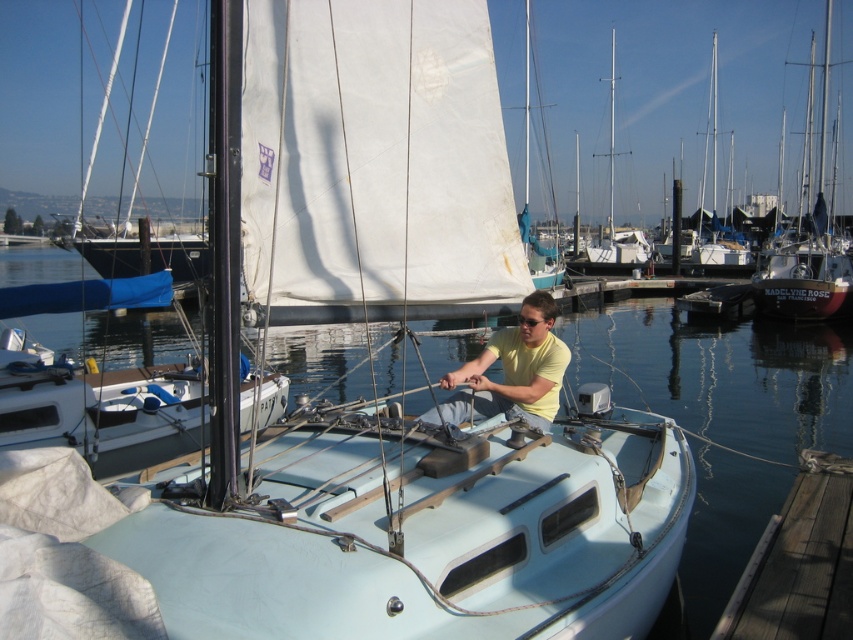
Does yellow matte shirt at center have a greater height compared to red matte sailboat at right?

No.

Can you confirm if yellow matte shirt at center is positioned below red matte sailboat at right?

Yes.

The height and width of the screenshot is (640, 853). What are the coordinates of `yellow matte shirt at center` in the screenshot? It's located at (511, 371).

The image size is (853, 640). In order to click on yellow matte shirt at center in this screenshot , I will do 511,371.

In the scene shown: Does wooden at lower right appear over red matte sailboat at right?

No, wooden at lower right is not above red matte sailboat at right.

Is point (773, 516) closer to camera compared to point (770, 307)?

Yes.

Is point (733, 611) farther from camera compared to point (814, 275)?

No, (733, 611) is in front of (814, 275).

The image size is (853, 640). In order to click on wooden at lower right in this screenshot , I will do `click(799, 563)`.

Can you confirm if white matte sailboat at center is positioned to the right of yellow matte shirt at center?

Incorrect, white matte sailboat at center is not on the right side of yellow matte shirt at center.

Who is taller, white matte sailboat at center or yellow matte shirt at center?

With more height is white matte sailboat at center.

Does point (173, 401) lie behind point (523, 413)?

Yes.

Find the location of a particular element. The image size is (853, 640). white matte sailboat at center is located at coordinates (99, 406).